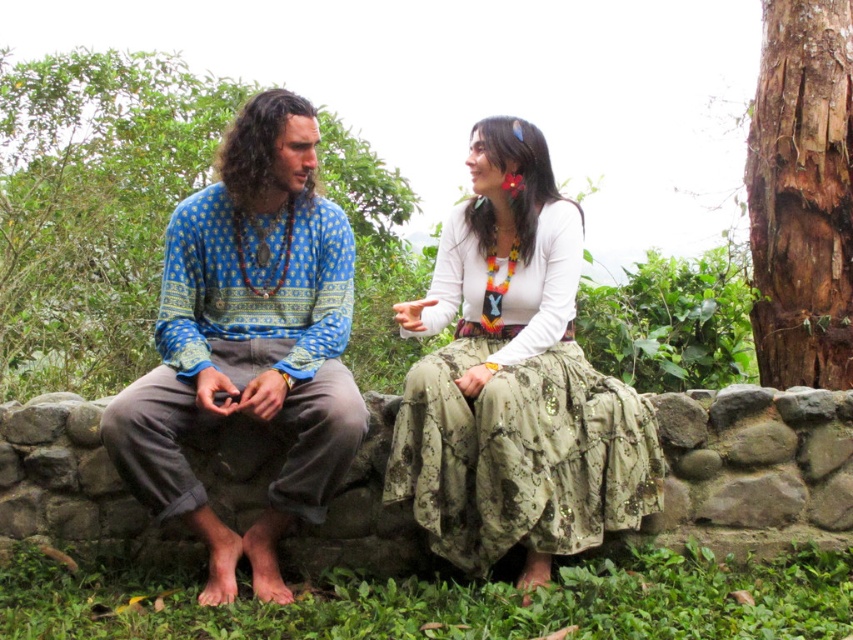
Question: Which of the following is the closest to the observer?

Choices:
 (A) (218, 397)
 (B) (851, 102)
 (C) (570, 509)

Answer: (C)

Question: Which point is closer to the camera?

Choices:
 (A) (477, 173)
 (B) (538, 376)

Answer: (B)

Question: Is blue printed shirt at center to the left of brown rough bark tree at upper right from the viewer's perspective?

Choices:
 (A) no
 (B) yes

Answer: (B)

Question: Is blue printed shirt at left thinner than gray stone wall at center?

Choices:
 (A) no
 (B) yes

Answer: (A)

Question: Which of the following is the closest to the observer?

Choices:
 (A) blue printed shirt at left
 (B) blue printed shirt at center
 (C) gray stone wall at center

Answer: (B)

Question: Is brown rough bark tree at left further to camera compared to white cotton blouse at upper center?

Choices:
 (A) yes
 (B) no

Answer: (A)